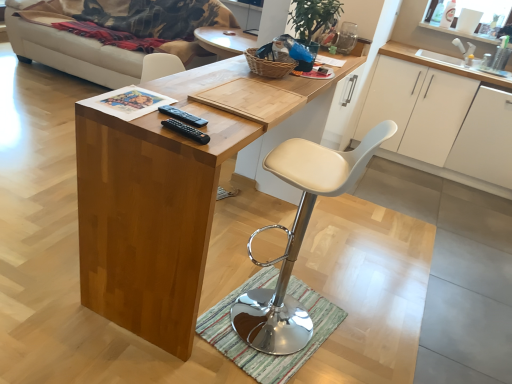
What are the coordinates of `vacant space to the right of black plastic remote at center` in the screenshot? It's located at (232, 135).